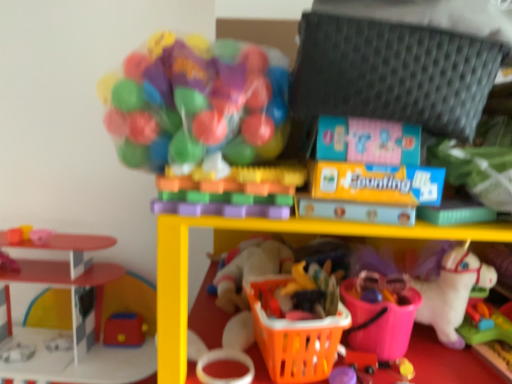
Where is `rubberized plastic toy at lower right, which is counted as the eighth toy, starting from the left`? rubberized plastic toy at lower right, which is counted as the eighth toy, starting from the left is located at coordinates (485, 324).

Image resolution: width=512 pixels, height=384 pixels. What do you see at coordinates (71, 320) in the screenshot? I see `smooth plastic playhouse at left, placed as the sixth toy when sorted from right to left` at bounding box center [71, 320].

I want to click on orange plastic basket at lower center, which is counted as the 1th basket, starting from the right, so click(x=380, y=322).

This screenshot has height=384, width=512. What do you see at coordinates (205, 124) in the screenshot?
I see `translucent plastic ball pit at upper center, which ranks as the 4th toy in right-to-left order` at bounding box center [205, 124].

The height and width of the screenshot is (384, 512). Find the location of `orange plastic basket at lower center`. orange plastic basket at lower center is located at coordinates (236, 242).

Where is `smooth plastic toy at left, the first toy from the left`? The width and height of the screenshot is (512, 384). smooth plastic toy at left, the first toy from the left is located at coordinates (19, 234).

In terms of width, does orange plastic basket at lower center look wider or thinner when compared to orange plastic basket at center, the 1th basket in the left-to-right sequence?

orange plastic basket at lower center is wider than orange plastic basket at center, the 1th basket in the left-to-right sequence.

From a real-world perspective, count 1st baskets upward from the orange plastic basket at lower center and point to it. Please provide its 2D coordinates.

[(293, 336)]

Is orange plastic basket at lower center facing towards orange plastic basket at center, which is counted as the second basket, starting from the right?

Yes, orange plastic basket at lower center is turned towards orange plastic basket at center, which is counted as the second basket, starting from the right.

From a real-world perspective, is orange plastic basket at lower center physically above orange plastic basket at center, which is counted as the second basket, starting from the right?

No, from a real-world perspective, orange plastic basket at lower center is not over orange plastic basket at center, which is counted as the second basket, starting from the right

From the image's perspective, is orange plastic basket at lower center on rubberized red toy at lower left, acting as the 5th toy starting from the right?

Correct, orange plastic basket at lower center appears higher than rubberized red toy at lower left, acting as the 5th toy starting from the right, in the image.

Does orange plastic basket at lower center have a smaller size compared to rubberized red toy at lower left, the fourth toy viewed from the left?

Actually, orange plastic basket at lower center might be larger than rubberized red toy at lower left, the fourth toy viewed from the left.

Is orange plastic basket at lower center completely or partially outside of rubberized red toy at lower left, acting as the 5th toy starting from the right?

That's correct, orange plastic basket at lower center is outside of rubberized red toy at lower left, acting as the 5th toy starting from the right.

Is point (128, 314) closer to camera compared to point (253, 171)?

No, (128, 314) is behind (253, 171).

Is rubberized red toy at lower left, acting as the 5th toy starting from the right, at the right side of translucent plastic blocks at center, which is the 3th toy in right-to-left order?

No, rubberized red toy at lower left, acting as the 5th toy starting from the right, is not to the right of translucent plastic blocks at center, which is the 3th toy in right-to-left order.

How much distance is there between rubberized red toy at lower left, the fourth toy viewed from the left, and translucent plastic blocks at center, which is the 6th toy in left-to-right order?

rubberized red toy at lower left, the fourth toy viewed from the left, is 3.93 feet away from translucent plastic blocks at center, which is the 6th toy in left-to-right order.

Which of these two, rubberized red toy at lower left, the fourth toy viewed from the left, or translucent plastic blocks at center, which is the 6th toy in left-to-right order, stands taller?

rubberized red toy at lower left, the fourth toy viewed from the left.

Does smooth plastic playhouse at left, the 3th toy in the left-to-right sequence, have a lesser width compared to pink rubber ball at left, the 7th toy from the right?

No, smooth plastic playhouse at left, the 3th toy in the left-to-right sequence, is not thinner than pink rubber ball at left, the 7th toy from the right.

In the scene shown: Between smooth plastic playhouse at left, placed as the sixth toy when sorted from right to left, and pink rubber ball at left, the second toy in the left-to-right sequence, which one has less height?

Standing shorter between the two is pink rubber ball at left, the second toy in the left-to-right sequence.

Is smooth plastic playhouse at left, placed as the sixth toy when sorted from right to left, facing away from pink rubber ball at left, the second toy in the left-to-right sequence?

No, smooth plastic playhouse at left, placed as the sixth toy when sorted from right to left, is not facing the opposite direction of pink rubber ball at left, the second toy in the left-to-right sequence.

Is smooth plastic playhouse at left, placed as the sixth toy when sorted from right to left, positioned far away from pink rubber ball at left, the 7th toy from the right?

A: No, smooth plastic playhouse at left, placed as the sixth toy when sorted from right to left, is not far from pink rubber ball at left, the 7th toy from the right.

Do you think smooth plastic toy at left, the first toy from the left, is within rubberized red toy at lower left, the fourth toy viewed from the left, or outside of it?

smooth plastic toy at left, the first toy from the left, is not inside rubberized red toy at lower left, the fourth toy viewed from the left, it's outside.

From a real-world perspective, does smooth plastic toy at left, the first toy from the left, sit lower than rubberized red toy at lower left, acting as the 5th toy starting from the right?

No, from a real-world perspective, smooth plastic toy at left, the first toy from the left, is not beneath rubberized red toy at lower left, acting as the 5th toy starting from the right.

Measure the distance from smooth plastic toy at left, which is the 8th toy from right to left, to rubberized red toy at lower left, acting as the 5th toy starting from the right.

20.43 inches.

Looking at this image, who is more distant, smooth plastic toy at left, which is the 8th toy from right to left, or rubberized red toy at lower left, acting as the 5th toy starting from the right?

rubberized red toy at lower left, acting as the 5th toy starting from the right, is further away from the camera.

Measure the distance from rubberized plastic toy at lower right, which is counted as the eighth toy, starting from the left, to rubberized red toy at lower left, acting as the 5th toy starting from the right.

They are 1.29 meters apart.

Which point is more distant from viewer, (470,315) or (139,322)?

The point (139,322) is more distant.

Looking at this image, from the image's perspective, relative to rubberized red toy at lower left, the fourth toy viewed from the left, is rubberized plastic toy at lower right, which ranks as the first toy in right-to-left order, above or below?

rubberized plastic toy at lower right, which ranks as the first toy in right-to-left order, is above rubberized red toy at lower left, the fourth toy viewed from the left.

From a real-world perspective, is rubberized plastic toy at lower right, which ranks as the first toy in right-to-left order, on top of rubberized red toy at lower left, the fourth toy viewed from the left?

Yes, from a real-world perspective, rubberized plastic toy at lower right, which ranks as the first toy in right-to-left order, is over rubberized red toy at lower left, the fourth toy viewed from the left

From the picture: From the image's perspective, is orange plastic basket at center, the 1th basket in the left-to-right sequence, above rubberized plastic toy at lower right, which is counted as the eighth toy, starting from the left?

Correct, orange plastic basket at center, the 1th basket in the left-to-right sequence, appears higher than rubberized plastic toy at lower right, which is counted as the eighth toy, starting from the left, in the image.

Based on the photo, based on their positions, is orange plastic basket at center, the 1th basket in the left-to-right sequence, located to the left or right of rubberized plastic toy at lower right, which is counted as the eighth toy, starting from the left?

Clearly, orange plastic basket at center, the 1th basket in the left-to-right sequence, is on the left of rubberized plastic toy at lower right, which is counted as the eighth toy, starting from the left, in the image.

Is orange plastic basket at center, the 1th basket in the left-to-right sequence, turned away from rubberized plastic toy at lower right, which ranks as the first toy in right-to-left order?

No, rubberized plastic toy at lower right, which ranks as the first toy in right-to-left order, is not at the back of orange plastic basket at center, the 1th basket in the left-to-right sequence.

Where is `basket that is the 1st object above the orange plastic basket at lower center (from a real-world perspective)`? basket that is the 1st object above the orange plastic basket at lower center (from a real-world perspective) is located at coordinates 293,336.

The image size is (512, 384). I want to click on the 6th toy behind when counting from the orange plastic basket at lower center, so click(x=124, y=330).

Considering their positions, is translucent plastic ball pit at upper center, which ranks as the 4th toy in right-to-left order, positioned closer to translucent plastic blocks at center, which is the 6th toy in left-to-right order, than pink rubber ball at left, the 7th toy from the right?

translucent plastic ball pit at upper center, which ranks as the 4th toy in right-to-left order, lies closer to translucent plastic blocks at center, which is the 6th toy in left-to-right order, than the other object.

When comparing their distances from smooth plastic playhouse at left, the 3th toy in the left-to-right sequence, does smooth plastic toy at left, which is the 8th toy from right to left, or rubberized red toy at lower left, acting as the 5th toy starting from the right, seem further?

The object further to smooth plastic playhouse at left, the 3th toy in the left-to-right sequence, is smooth plastic toy at left, which is the 8th toy from right to left.

From the image, which object appears to be farther from smooth plastic toy at left, which is the 8th toy from right to left, rubber yellow ball at lower center, which ranks as the seventh toy in left-to-right order, or smooth plastic playhouse at left, placed as the sixth toy when sorted from right to left?

rubber yellow ball at lower center, which ranks as the seventh toy in left-to-right order.

Estimate the real-world distances between objects in this image. Which object is closer to orange plastic basket at lower center, arranged as the 2th basket when viewed from the left, translucent plastic ball pit at upper center, which ranks as the fifth toy in left-to-right order, or pink rubber ball at left, the second toy in the left-to-right sequence?

translucent plastic ball pit at upper center, which ranks as the fifth toy in left-to-right order, lies closer to orange plastic basket at lower center, arranged as the 2th basket when viewed from the left, than the other object.

When comparing their distances from pink rubber ball at left, the 7th toy from the right, does orange plastic basket at lower center or rubber yellow ball at lower center, which ranks as the seventh toy in left-to-right order, seem further?

rubber yellow ball at lower center, which ranks as the seventh toy in left-to-right order, is positioned further to the anchor pink rubber ball at left, the 7th toy from the right.

When comparing their distances from rubberized red toy at lower left, the fourth toy viewed from the left, does smooth plastic toy at left, the first toy from the left, or pink rubber ball at left, the 7th toy from the right, seem further?

smooth plastic toy at left, the first toy from the left, lies further to rubberized red toy at lower left, the fourth toy viewed from the left, than the other object.

When comparing their distances from rubber yellow ball at lower center, arranged as the 2th toy when viewed from the right, does translucent plastic blocks at center, which is the 3th toy in right-to-left order, or rubberized red toy at lower left, the fourth toy viewed from the left, seem closer?

Based on the image, translucent plastic blocks at center, which is the 3th toy in right-to-left order, appears to be nearer to rubber yellow ball at lower center, arranged as the 2th toy when viewed from the right.

Based on their spatial positions, is smooth plastic toy at left, the first toy from the left, or translucent plastic blocks at center, which is the 3th toy in right-to-left order, further from translucent plastic ball pit at upper center, which ranks as the 4th toy in right-to-left order?

smooth plastic toy at left, the first toy from the left.

Where is `shelf situated between orange plastic basket at lower center, which is counted as the 1th basket, starting from the right, and rubberized plastic toy at lower right, which is counted as the eighth toy, starting from the left, from left to right`? shelf situated between orange plastic basket at lower center, which is counted as the 1th basket, starting from the right, and rubberized plastic toy at lower right, which is counted as the eighth toy, starting from the left, from left to right is located at coordinates (236, 242).

This screenshot has height=384, width=512. I want to click on basket positioned between rubber yellow ball at lower center, which ranks as the seventh toy in left-to-right order, and rubberized red toy at lower left, the fourth toy viewed from the left, from near to far, so click(x=380, y=322).

Find the location of a particular element. The image size is (512, 384). basket between translucent plastic blocks at center, which is the 6th toy in left-to-right order, and orange plastic basket at center, the 1th basket in the left-to-right sequence, from top to bottom is located at coordinates (380, 322).

This screenshot has width=512, height=384. I want to click on toy between translucent plastic ball pit at upper center, which ranks as the 4th toy in right-to-left order, and orange plastic basket at lower center, which is counted as the 1th basket, starting from the right, in the horizontal direction, so click(x=232, y=192).